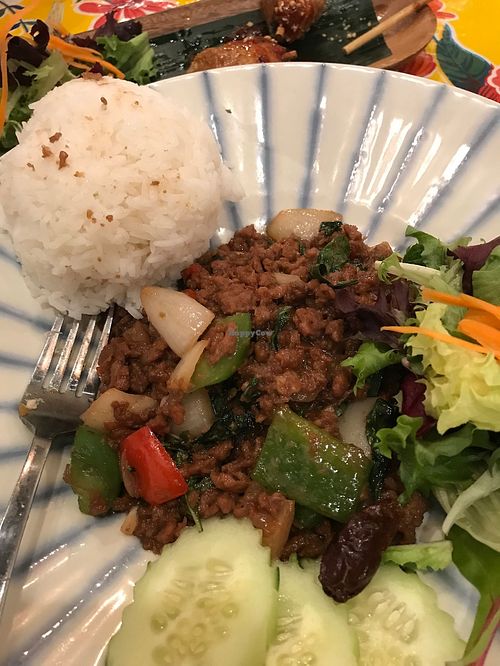
Where is `wood dish`? wood dish is located at coordinates 398,33.